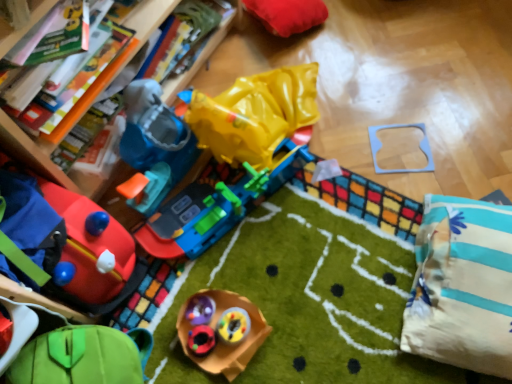
Question: Does rubberized plastic toy at center, the fourth toy in the top-to-bottom sequence, appear on the right side of velvet red cushion at upper center, arranged as the first toy when viewed from the top?

Choices:
 (A) yes
 (B) no

Answer: (B)

Question: Is the depth of rubberized plastic toy at center, the fourth toy in the top-to-bottom sequence, less than that of velvet red cushion at upper center, marked as the seventh toy in a bottom-to-top arrangement?

Choices:
 (A) no
 (B) yes

Answer: (B)

Question: From the image's perspective, is rubberized plastic toy at center, the fourth toy in the top-to-bottom sequence, under velvet red cushion at upper center, marked as the seventh toy in a bottom-to-top arrangement?

Choices:
 (A) yes
 (B) no

Answer: (A)

Question: Is rubberized plastic toy at center, the fourth toy in the bottom-to-top sequence, smaller than velvet red cushion at upper center, marked as the seventh toy in a bottom-to-top arrangement?

Choices:
 (A) yes
 (B) no

Answer: (A)

Question: Can you confirm if rubberized plastic toy at center, the fourth toy in the bottom-to-top sequence, is thinner than velvet red cushion at upper center, arranged as the first toy when viewed from the top?

Choices:
 (A) no
 (B) yes

Answer: (B)

Question: Is rubberized plastic toy at center, the fourth toy in the bottom-to-top sequence, with velvet red cushion at upper center, arranged as the first toy when viewed from the top?

Choices:
 (A) yes
 (B) no

Answer: (B)

Question: Is the position of rubberized plastic toy at center, the sixth toy from the top, more distant than that of wooden puzzle piece at upper center, the 2th toy in the top-to-bottom sequence?

Choices:
 (A) yes
 (B) no

Answer: (B)

Question: Can you confirm if rubberized plastic toy at center, the sixth toy from the top, is taller than wooden puzzle piece at upper center, the 6th toy when ordered from bottom to top?

Choices:
 (A) yes
 (B) no

Answer: (A)

Question: Considering the relative positions of rubberized plastic toy at center, placed as the second toy when sorted from bottom to top, and wooden puzzle piece at upper center, the 6th toy when ordered from bottom to top, in the image provided, is rubberized plastic toy at center, placed as the second toy when sorted from bottom to top, to the left of wooden puzzle piece at upper center, the 6th toy when ordered from bottom to top, from the viewer's perspective?

Choices:
 (A) yes
 (B) no

Answer: (A)

Question: From a real-world perspective, is rubberized plastic toy at center, the sixth toy from the top, physically below wooden puzzle piece at upper center, the 6th toy when ordered from bottom to top?

Choices:
 (A) yes
 (B) no

Answer: (B)

Question: Is rubberized plastic toy at center, the sixth toy from the top, positioned before wooden puzzle piece at upper center, the 6th toy when ordered from bottom to top?

Choices:
 (A) yes
 (B) no

Answer: (A)

Question: Is rubberized plastic toy at center, the sixth toy from the top, beside wooden puzzle piece at upper center, the 2th toy in the top-to-bottom sequence?

Choices:
 (A) no
 (B) yes

Answer: (A)

Question: Is white striped pillow at lower right further to the viewer compared to rubberized plastic toy at center, the fourth toy in the top-to-bottom sequence?

Choices:
 (A) no
 (B) yes

Answer: (A)